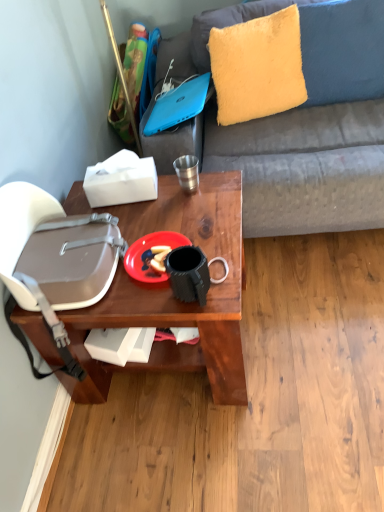
Image resolution: width=384 pixels, height=512 pixels. In order to click on vacant point to the right of plastic matte plate at center in this screenshot , I will do `click(216, 234)`.